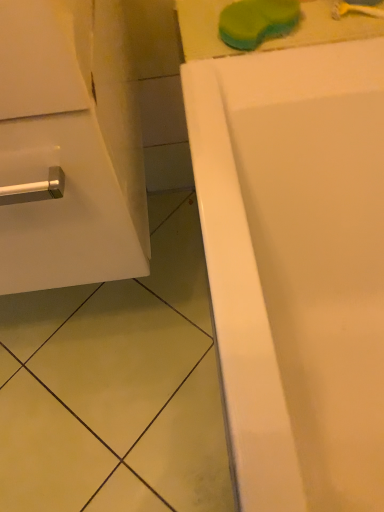
Question: Considering the relative sizes of white glossy cabinet at left and green sponge at upper center in the image provided, is white glossy cabinet at left taller than green sponge at upper center?

Choices:
 (A) no
 (B) yes

Answer: (B)

Question: Is white glossy cabinet at left touching green sponge at upper center?

Choices:
 (A) no
 (B) yes

Answer: (A)

Question: Does white glossy cabinet at left come in front of green sponge at upper center?

Choices:
 (A) yes
 (B) no

Answer: (A)

Question: Considering the relative positions of white glossy cabinet at left and green sponge at upper center in the image provided, is white glossy cabinet at left to the right of green sponge at upper center from the viewer's perspective?

Choices:
 (A) yes
 (B) no

Answer: (B)

Question: Is the position of white glossy cabinet at left more distant than that of green sponge at upper center?

Choices:
 (A) yes
 (B) no

Answer: (B)

Question: Does point (352, 11) appear closer or farther from the camera than point (51, 50)?

Choices:
 (A) closer
 (B) farther

Answer: (B)

Question: Is yellow plastic toothbrush at upper right wider or thinner than white glossy cabinet at left?

Choices:
 (A) thin
 (B) wide

Answer: (A)

Question: Do you think yellow plastic toothbrush at upper right is within white glossy cabinet at left, or outside of it?

Choices:
 (A) outside
 (B) inside

Answer: (A)

Question: Relative to white glossy cabinet at left, is yellow plastic toothbrush at upper right in front or behind?

Choices:
 (A) behind
 (B) front

Answer: (A)

Question: Considering their positions, is yellow plastic toothbrush at upper right located in front of or behind green sponge at upper center?

Choices:
 (A) front
 (B) behind

Answer: (B)

Question: From the image's perspective, is yellow plastic toothbrush at upper right located above or below green sponge at upper center?

Choices:
 (A) above
 (B) below

Answer: (A)

Question: Considering the positions of yellow plastic toothbrush at upper right and green sponge at upper center in the image, is yellow plastic toothbrush at upper right wider or thinner than green sponge at upper center?

Choices:
 (A) thin
 (B) wide

Answer: (A)

Question: Based on their positions, is yellow plastic toothbrush at upper right located to the left or right of green sponge at upper center?

Choices:
 (A) right
 (B) left

Answer: (A)

Question: From the image's perspective, relative to white glossy cabinet at left, is green sponge at upper center above or below?

Choices:
 (A) below
 (B) above

Answer: (B)

Question: Would you say green sponge at upper center is to the left or to the right of white glossy cabinet at left in the picture?

Choices:
 (A) right
 (B) left

Answer: (A)